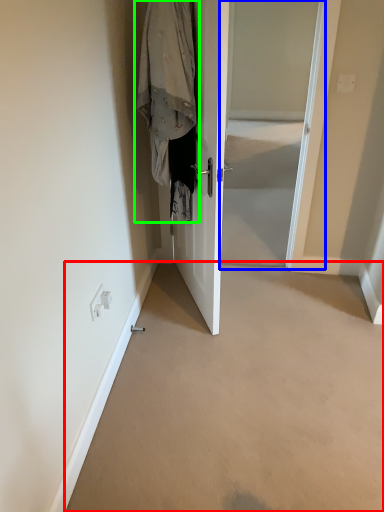
Question: Which object is positioned farthest from corridor (highlighted by a red box)? Select from screen door (highlighted by a blue box) and clothing (highlighted by a green box).

Choices:
 (A) screen door
 (B) clothing

Answer: (A)